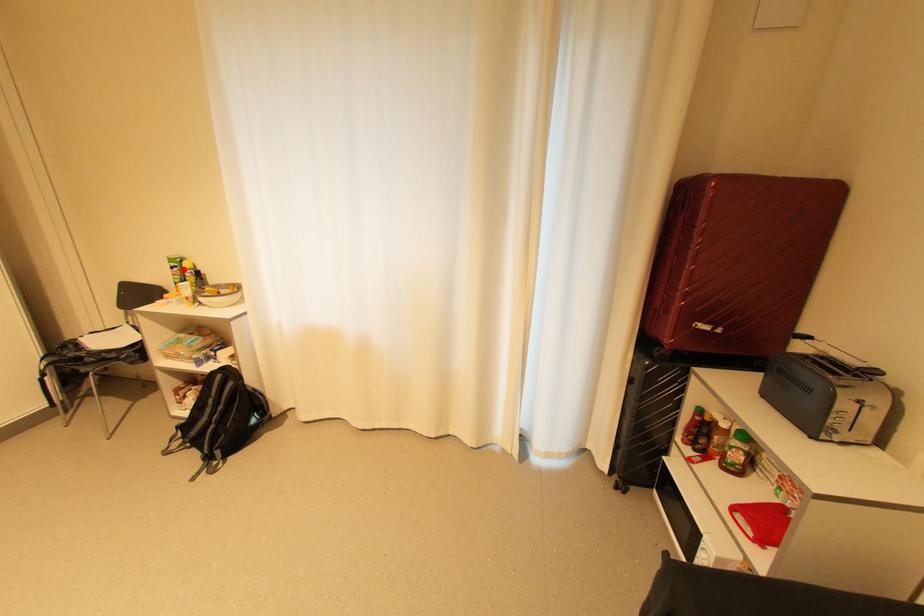
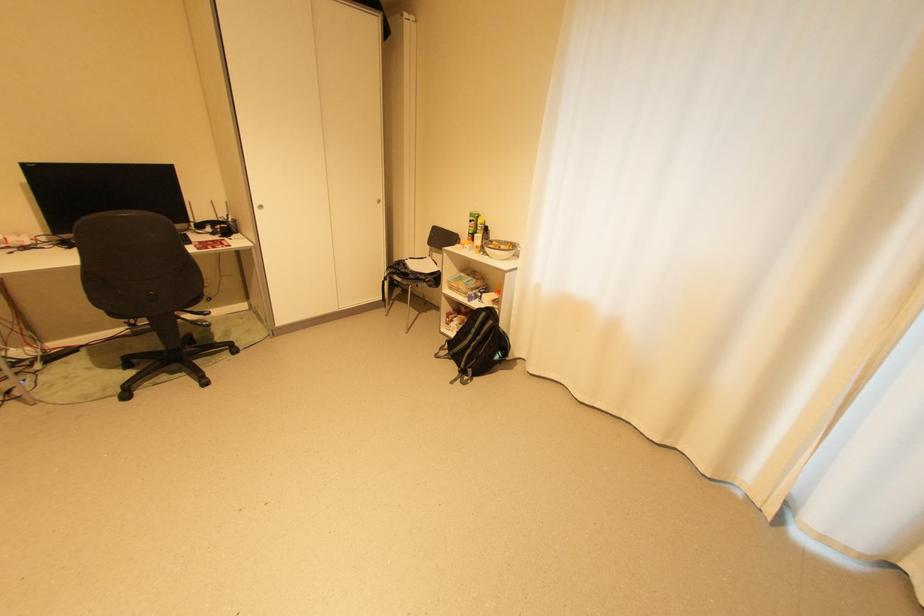
Question: A red point is marked in image1. In image2, is the corresponding 3D point closer to the camera or farther? Reply with the corresponding letter.

Choices:
 (A) The corresponding 3D point is closer.
 (B) The corresponding 3D point is farther.

Answer: (A)